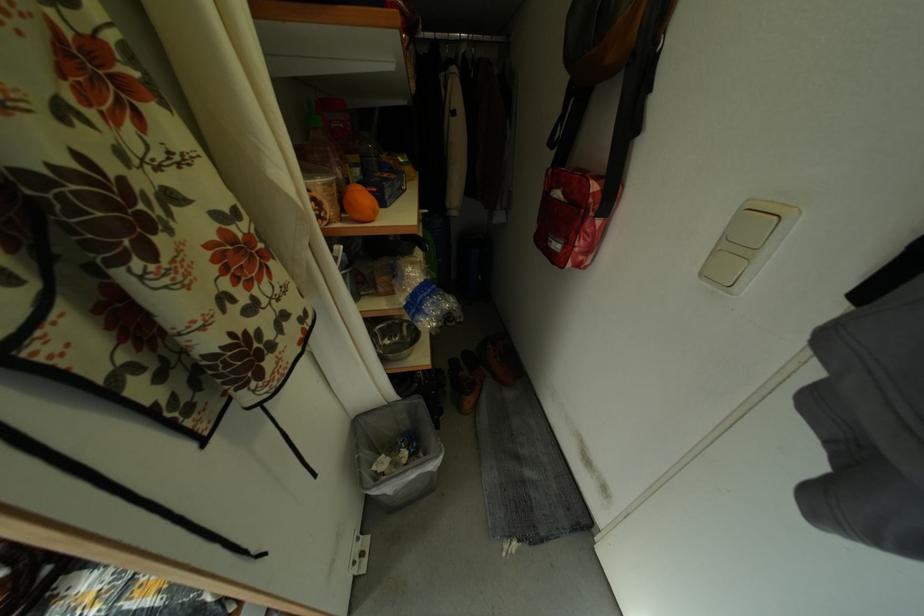
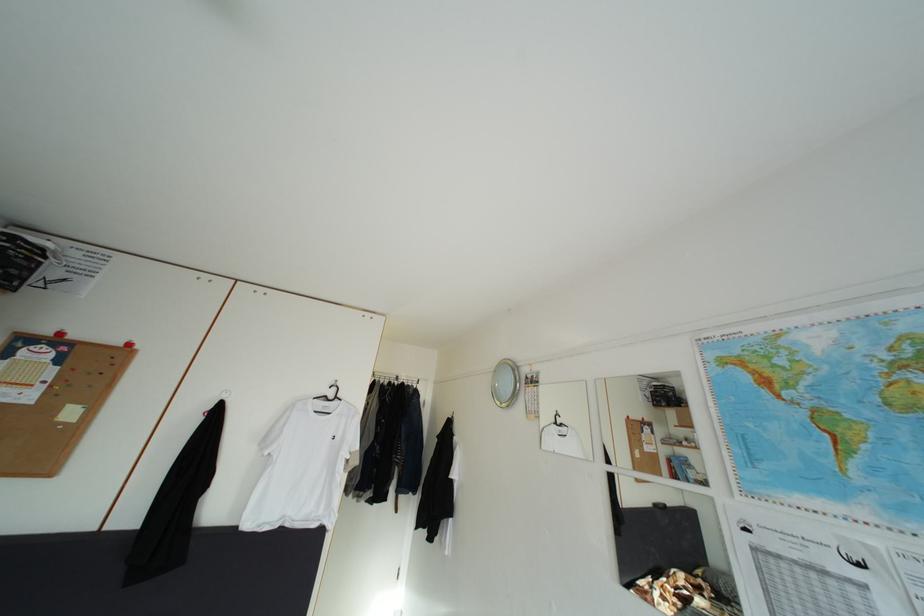
Question: I am providing you with two images of the same scene from different viewpoints. After the viewpoint changes to image2, which objects are now occluded?

Choices:
 (A) white clothes hanger
 (B) bottle cap
 (C) red shoulder bag
 (D) white wall hook

Answer: (C)